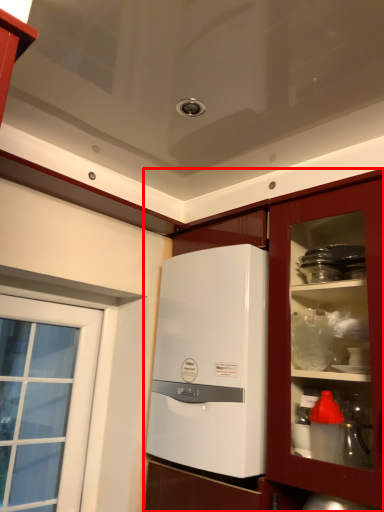
Question: From the image's perspective, considering the relative positions of cabinetry (annotated by the red box) and home appliance in the image provided, where is cabinetry (annotated by the red box) located with respect to the staircase?

Choices:
 (A) below
 (B) above

Answer: (A)